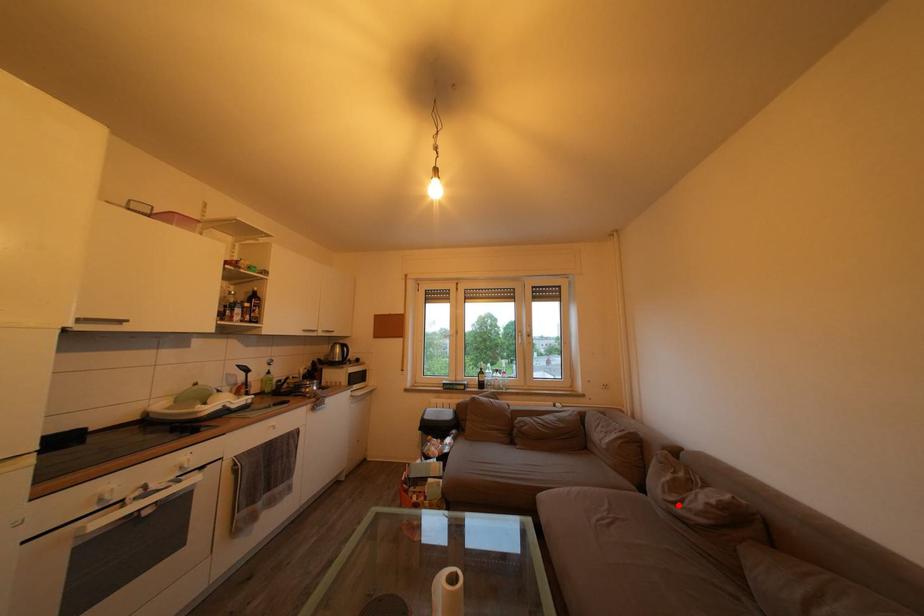
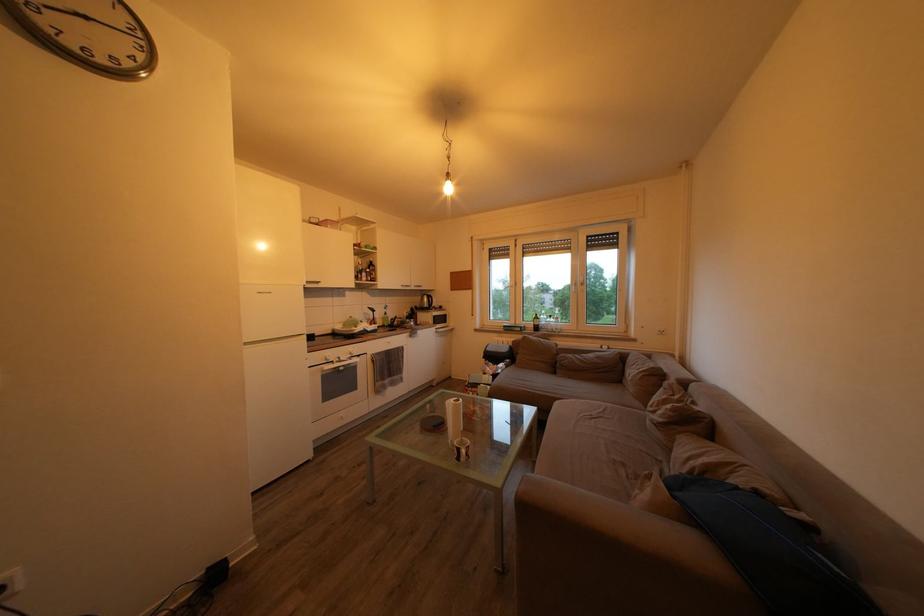
Question: A red point is marked in image1. In image2, is the corresponding 3D point closer to the camera or farther? Reply with the corresponding letter.

Choices:
 (A) The corresponding 3D point is closer.
 (B) The corresponding 3D point is farther.

Answer: (A)